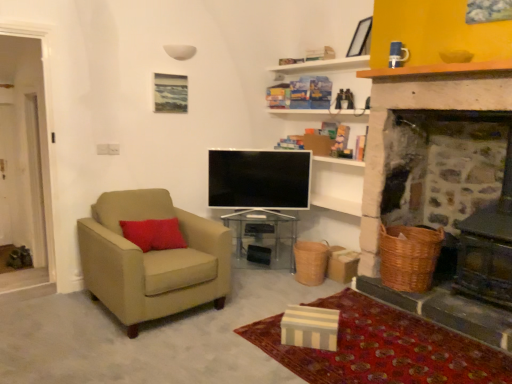
Identify the location of empty space that is in between braided wicker basket at lower center, which is the second basket in right-to-left order, and striped fabric box at lower center. This screenshot has width=512, height=384. (282, 293).